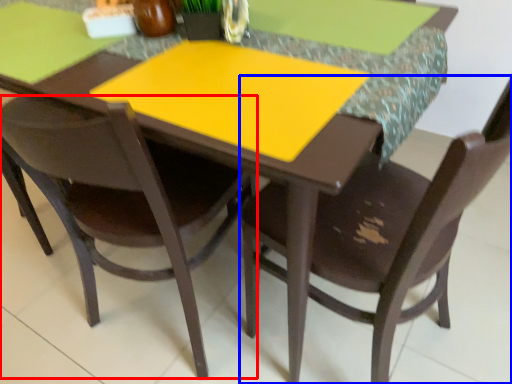
Question: Among these objects, which one is nearest to the camera, chair (highlighted by a red box) or chair (highlighted by a blue box)?

Choices:
 (A) chair
 (B) chair

Answer: (B)